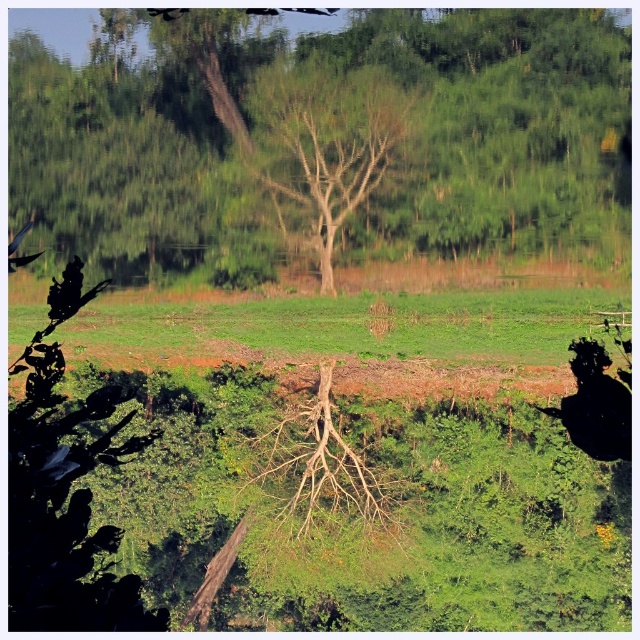
Question: Which object is farther from the camera taking this photo?

Choices:
 (A) green grassy field at center
 (B) green leafy tree at center

Answer: (A)

Question: Can you confirm if green grassy field at center is wider than bare wood tree at center?

Choices:
 (A) yes
 (B) no

Answer: (A)

Question: Does green leafy tree at center have a smaller size compared to bare wood tree at center?

Choices:
 (A) yes
 (B) no

Answer: (B)

Question: Which point appears closest to the camera in this image?

Choices:
 (A) (179, 342)
 (B) (164, 166)
 (C) (262, 80)

Answer: (C)

Question: Can you confirm if green leafy tree at center is positioned above bare wood tree at center?

Choices:
 (A) yes
 (B) no

Answer: (A)

Question: Among these objects, which one is farthest from the camera?

Choices:
 (A) bare wood tree at center
 (B) green leafy tree at center

Answer: (A)